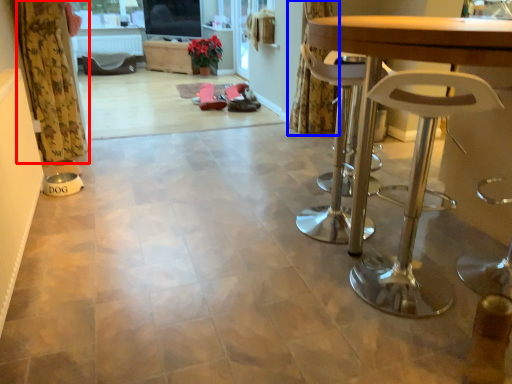
Question: Among these objects, which one is nearest to the camera, curtain (highlighted by a red box) or curtain (highlighted by a blue box)?

Choices:
 (A) curtain
 (B) curtain

Answer: (A)